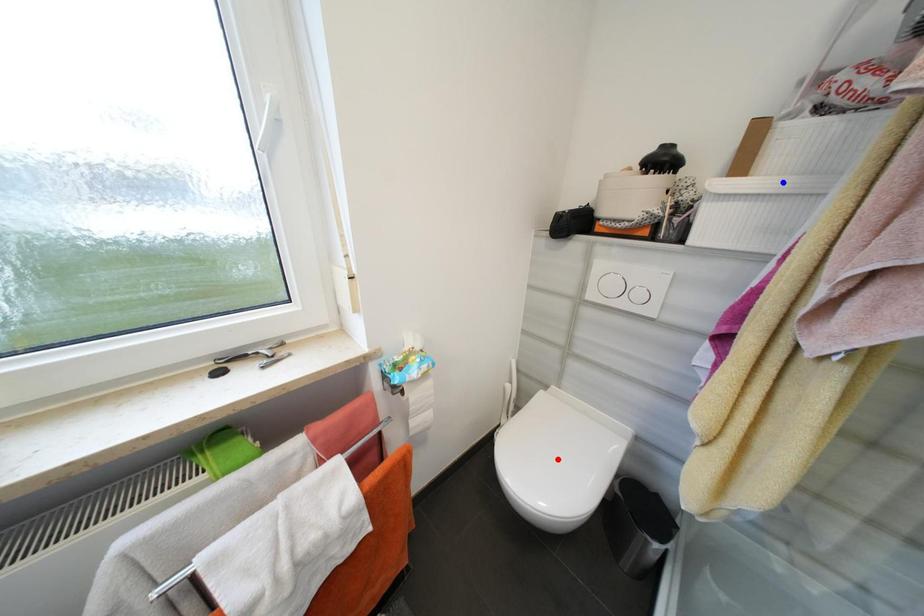
Question: Which of the two points in the image is closer to the camera?

Choices:
 (A) Blue point is closer.
 (B) Red point is closer.

Answer: (A)